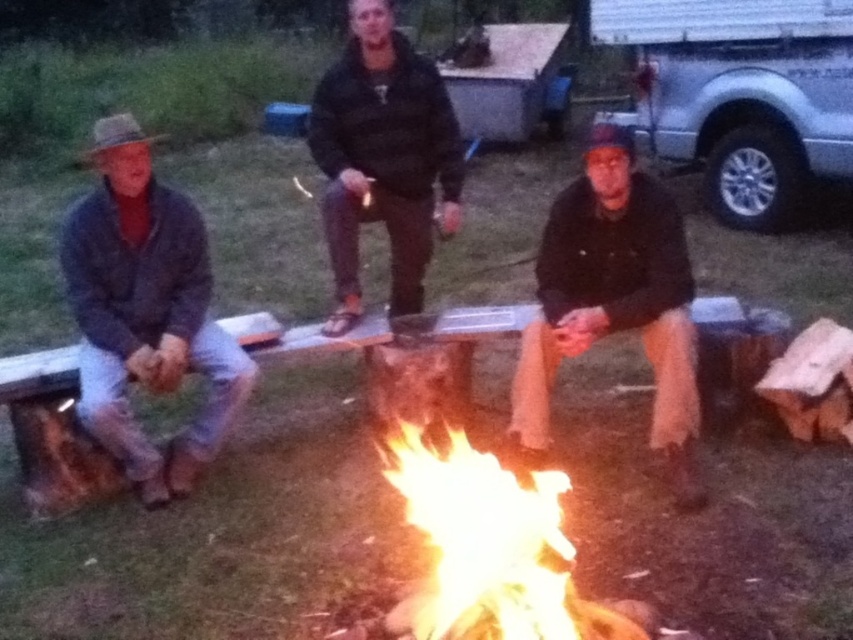
Question: Can you confirm if dark brown leather jacket at center is positioned above flaming wood at center?

Choices:
 (A) no
 (B) yes

Answer: (B)

Question: Does flaming wood at center have a greater width compared to black matte jacket at center?

Choices:
 (A) yes
 (B) no

Answer: (B)

Question: Which point is closer to the camera?

Choices:
 (A) (62, 250)
 (B) (724, 12)
 (C) (375, 170)
 (D) (582, 202)

Answer: (D)

Question: Which point is closer to the camera?

Choices:
 (A) (566, 561)
 (B) (685, 392)
 (C) (178, 275)

Answer: (A)

Question: Which point is closer to the camera?

Choices:
 (A) (395, 461)
 (B) (442, 177)
 (C) (717, 145)

Answer: (A)

Question: Can you confirm if flaming wood at center is thinner than black matte jacket at center?

Choices:
 (A) yes
 (B) no

Answer: (A)